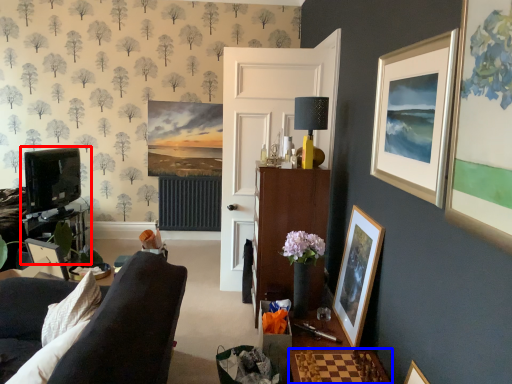
Question: Among these objects, which one is nearest to the camera, entertainment center (highlighted by a red box) or table (highlighted by a blue box)?

Choices:
 (A) entertainment center
 (B) table

Answer: (B)